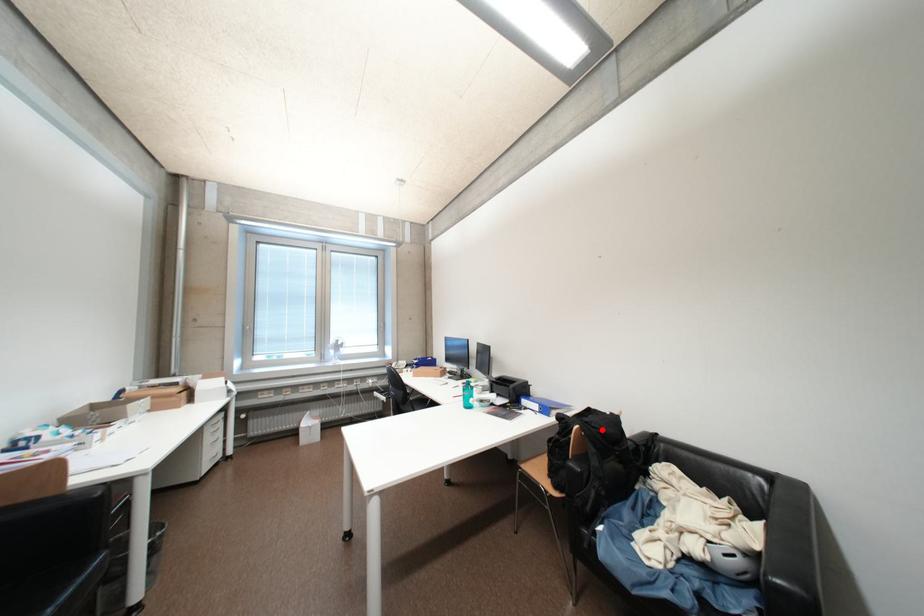
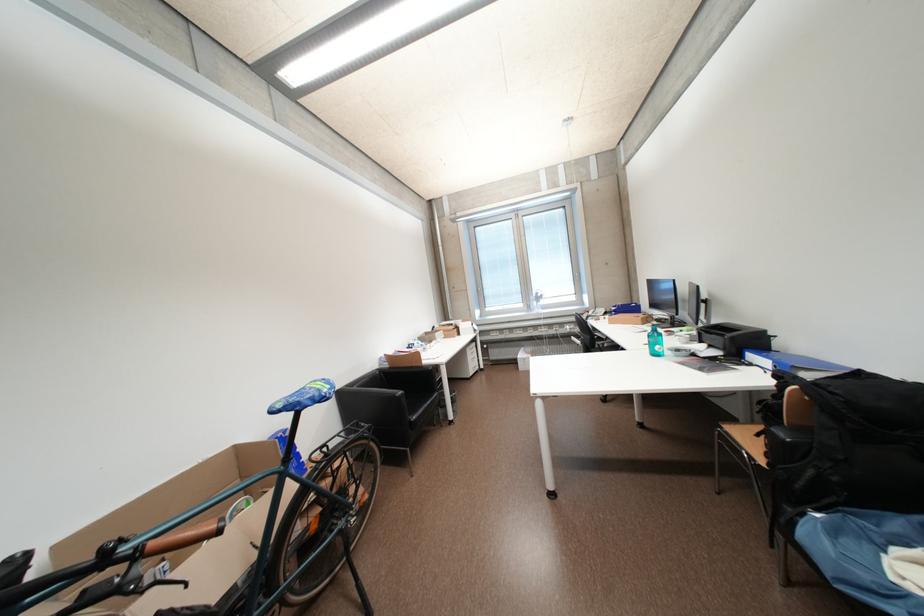
Question: I am providing you with two images of the same scene from different viewpoints. In image1, a red point is highlighted. Considering the same 3D point in image2, which of the following is correct?

Choices:
 (A) It is closer
 (B) It is farther

Answer: (A)